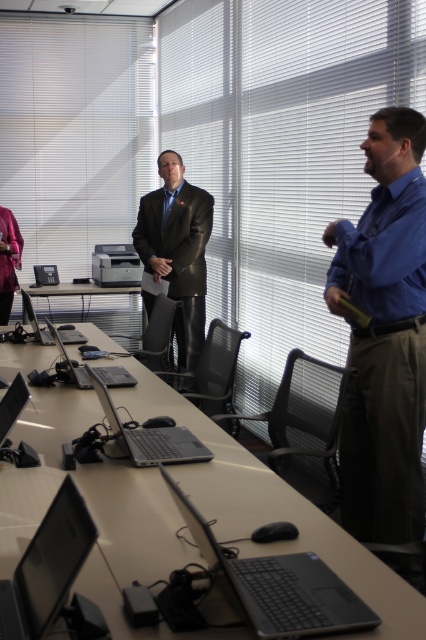
Does black leather jacket at center have a larger size compared to matte black printer at left?

Correct, black leather jacket at center is larger in size than matte black printer at left.

Who is more distant from viewer, [143,225] or [42,264]?

The point [42,264] is behind.

You are a GUI agent. You are given a task and a screenshot of the screen. Output one action in this format:
    pyautogui.click(x=<x>, y=<y>)
    Task: Click on the black leather jacket at center
    The width and height of the screenshot is (426, 640).
    Given the screenshot: What is the action you would take?
    pyautogui.click(x=178, y=259)

Is point (134, 518) less distant than point (199, 513)?

No.

What are the coordinates of `light brown wooden table at center` in the screenshot? It's located at [x=271, y=509].

Which of these two, light brown wooden table at center or matte black table at center, stands taller?

Standing taller between the two is light brown wooden table at center.

Can you confirm if light brown wooden table at center is positioned to the right of matte black table at center?

Indeed, light brown wooden table at center is positioned on the right side of matte black table at center.

Image resolution: width=426 pixels, height=640 pixels. Identify the location of light brown wooden table at center. (271, 509).